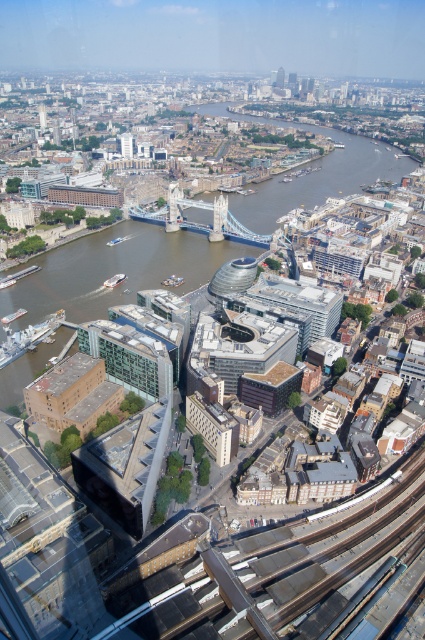
Question: Estimate the real-world distances between objects in this image. Which object is farther from the brown water at center?

Choices:
 (A) silver metallic bridge at center
 (B) matte gray tower at upper center
 (C) green glass windows at center

Answer: (B)

Question: Can you confirm if silver metallic bridge at center is positioned to the left of matte gray tower at upper center?

Choices:
 (A) yes
 (B) no

Answer: (B)

Question: Which of the following is the closest to the observer?

Choices:
 (A) (127, 145)
 (B) (71, 307)
 (C) (153, 392)

Answer: (C)

Question: Which point is closer to the camera taking this photo?

Choices:
 (A) (108, 333)
 (B) (226, 209)
 (C) (121, 134)
 (D) (371, 148)

Answer: (A)

Question: Does silver metallic bridge at center have a smaller size compared to matte gray tower at upper center?

Choices:
 (A) no
 (B) yes

Answer: (B)

Question: Does brown water at center appear under silver metallic bridge at center?

Choices:
 (A) yes
 (B) no

Answer: (B)